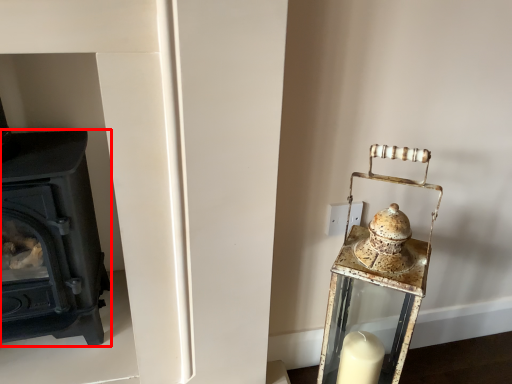
Question: Observing the image, what is the correct spatial positioning of wood burning stove (annotated by the red box) in reference to table lamp?

Choices:
 (A) right
 (B) left

Answer: (B)